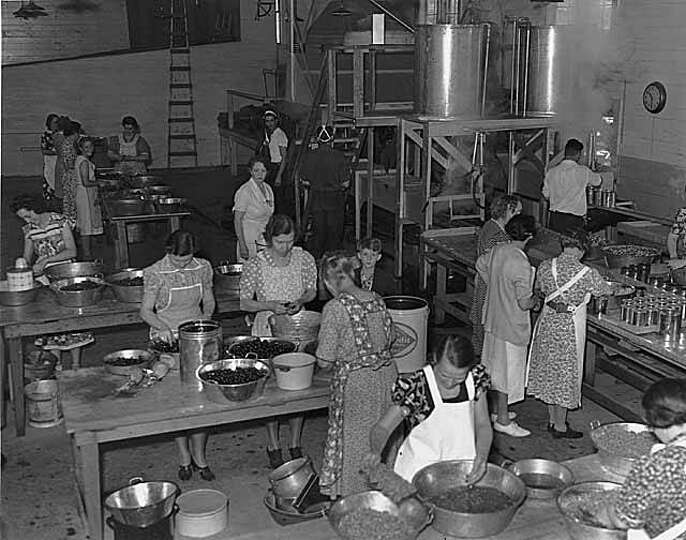
At what (x,y) coordinates should I click in order to perform the action: click on steel trays on tables. Please return your answer as a coordinate pair (x, y). The width and height of the screenshot is (686, 540). Looking at the image, I should click on (90, 289), (123, 282), (228, 373), (252, 347), (477, 498), (543, 481), (588, 514), (379, 516), (126, 363).